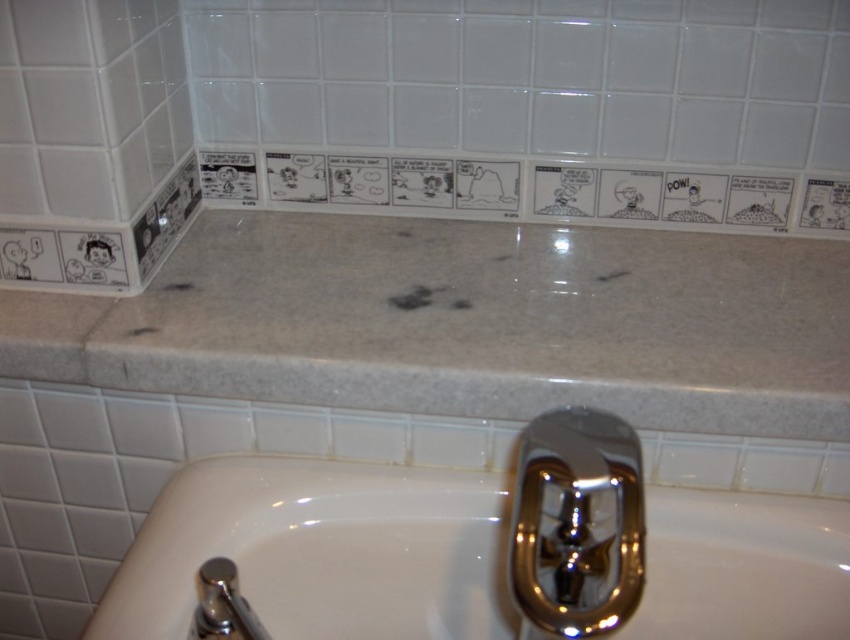
Does point (769, 387) lie in front of point (690, 509)?

Yes, point (769, 387) is closer to viewer.

Does white marble counter top at upper center appear on the left side of white glossy bathtub at lower center?

Indeed, white marble counter top at upper center is positioned on the left side of white glossy bathtub at lower center.

Is point (539, 280) more distant than point (316, 564)?

That is True.

Where is `white marble counter top at upper center`? The width and height of the screenshot is (850, 640). white marble counter top at upper center is located at coordinates [468, 323].

This screenshot has height=640, width=850. What do you see at coordinates (321, 552) in the screenshot? I see `white glossy bathtub at lower center` at bounding box center [321, 552].

Where is `white glossy bathtub at lower center`? white glossy bathtub at lower center is located at coordinates (321, 552).

This screenshot has width=850, height=640. What are the coordinates of `white glossy bathtub at lower center` in the screenshot? It's located at (321, 552).

How distant is white marble counter top at upper center from polished chrome faucet at lower left?

They are 14.16 inches apart.

You are a GUI agent. You are given a task and a screenshot of the screen. Output one action in this format:
    pyautogui.click(x=<x>, y=<y>)
    Task: Click on the white marble counter top at upper center
    
    Given the screenshot: What is the action you would take?
    click(x=468, y=323)